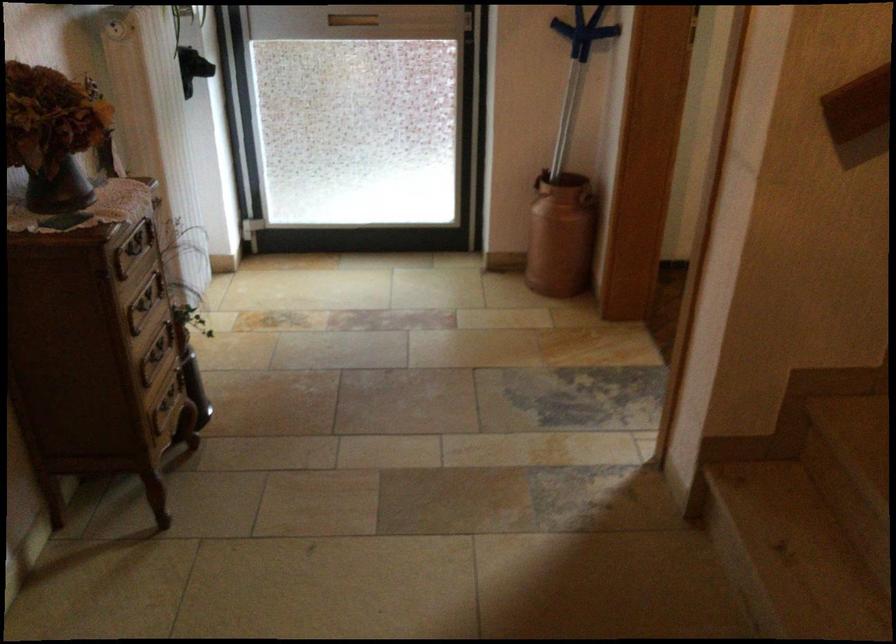
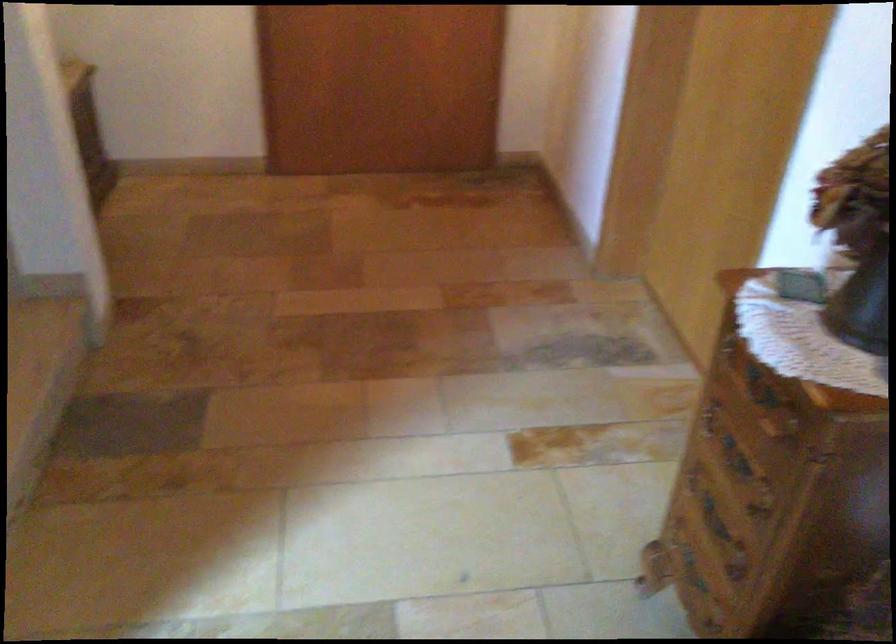
The point at (130,351) is marked in the first image. Where is the corresponding point in the second image?

(735, 457)